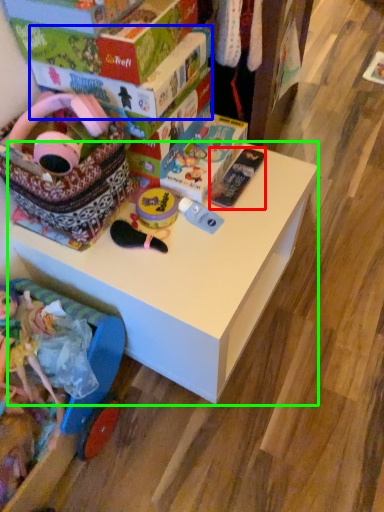
Question: Based on their relative distances, which object is farther from toy (highlighted by a red box)? Choose from box (highlighted by a blue box) and table (highlighted by a green box).

Choices:
 (A) box
 (B) table

Answer: (A)